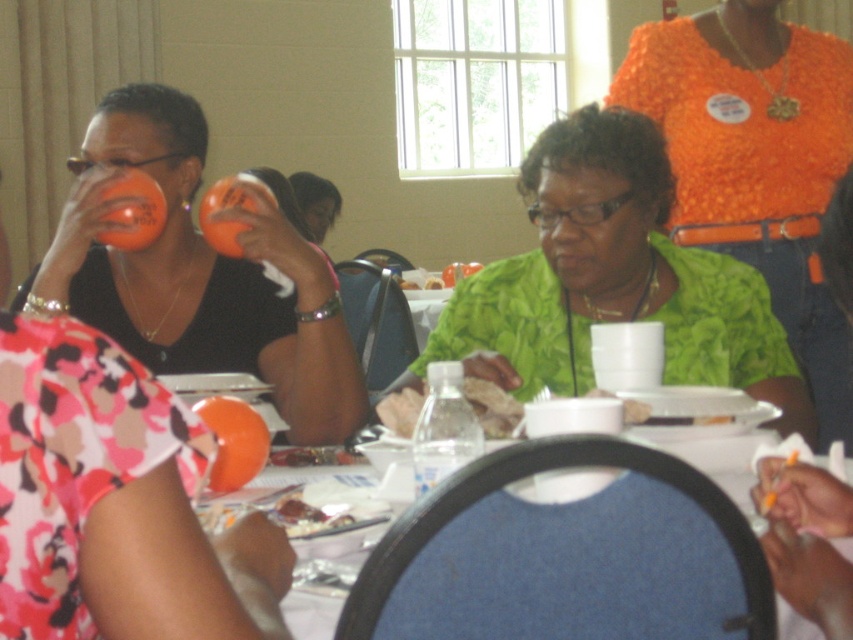
Question: Which point is closer to the camera?

Choices:
 (A) green fabric shirt at center
 (B) translucent plastic baguette at center
 (C) matte orange cup at upper center

Answer: (B)

Question: Does blue fabric chair at lower center have a lesser width compared to matte orange cup at upper center?

Choices:
 (A) no
 (B) yes

Answer: (A)

Question: Estimate the real-world distances between objects in this image. Which object is farther from the green fabric shirt at center?

Choices:
 (A) translucent plastic baguette at center
 (B) orange textured shirt at upper right
 (C) clear plastic bottle at center

Answer: (C)

Question: In this image, where is green fabric shirt at center located relative to orange textured shirt at upper right?

Choices:
 (A) left
 (B) right

Answer: (A)

Question: Which object appears closest to the camera in this image?

Choices:
 (A) blue fabric chair at lower center
 (B) translucent plastic baguette at center
 (C) matte orange cup at upper center
 (D) orange textured shirt at upper right

Answer: (A)

Question: Is green fabric shirt at center to the left of translucent plastic baguette at center from the viewer's perspective?

Choices:
 (A) yes
 (B) no

Answer: (B)